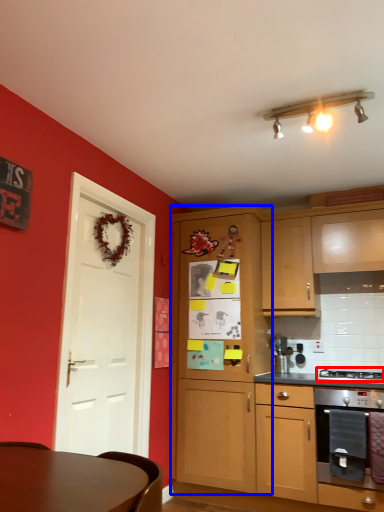
Question: Which point is further to the camera, gas stove (highlighted by a red box) or cabinetry (highlighted by a blue box)?

Choices:
 (A) gas stove
 (B) cabinetry

Answer: (B)